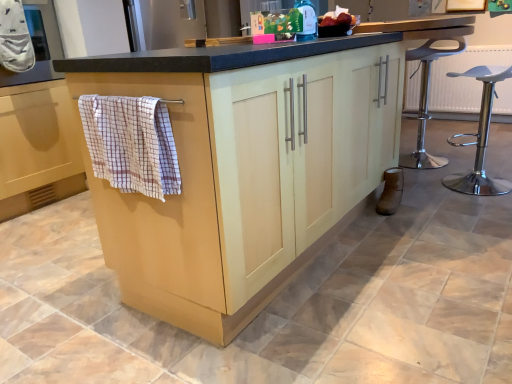
At what (x,y) coordinates should I click in order to perform the action: click on free region under white plastic stool at right (from a real-world perspective). Please return your answer as a coordinate pair (x, y). Looking at the image, I should click on (477, 190).